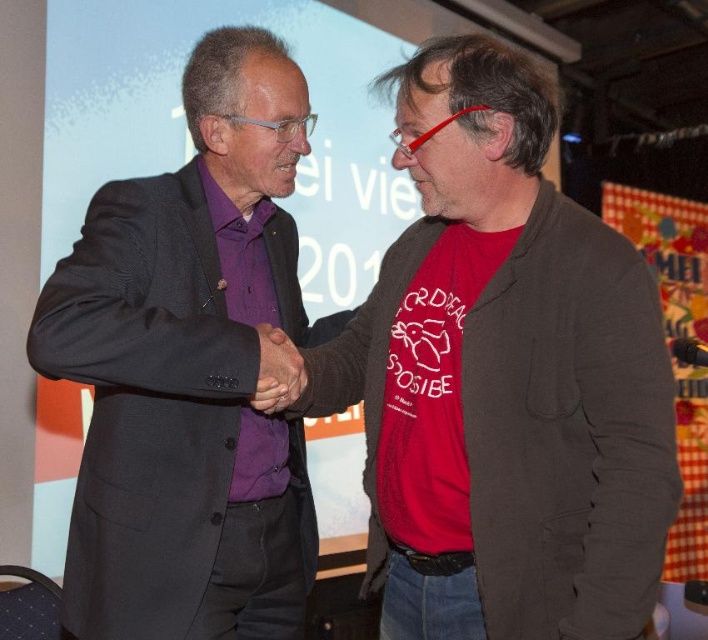
Question: Estimate the real-world distances between objects in this image. Which object is farther from the matte brown jacket at center?

Choices:
 (A) matte black hand at center
 (B) purple matte suit at center

Answer: (B)

Question: Is purple matte suit at center wider than matte black hand at center?

Choices:
 (A) yes
 (B) no

Answer: (A)

Question: Is matte brown jacket at center thinner than matte black hand at center?

Choices:
 (A) no
 (B) yes

Answer: (A)

Question: Which point is farther from the camera taking this photo?

Choices:
 (A) 515,300
 (B) 256,404

Answer: (B)

Question: Which of the following is the farthest from the observer?

Choices:
 (A) matte brown jacket at center
 (B) matte black hand at center

Answer: (B)

Question: Is matte brown jacket at center positioned in front of purple matte suit at center?

Choices:
 (A) no
 (B) yes

Answer: (B)